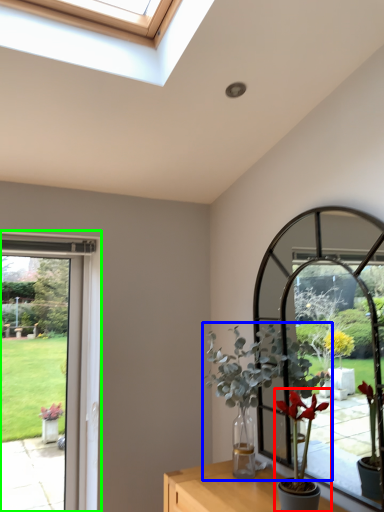
Question: Estimate the real-world distances between objects in this image. Which object is farther from houseplant (highlighted by a red box), houseplant (highlighted by a blue box) or window frame (highlighted by a green box)?

Choices:
 (A) houseplant
 (B) window frame

Answer: (B)